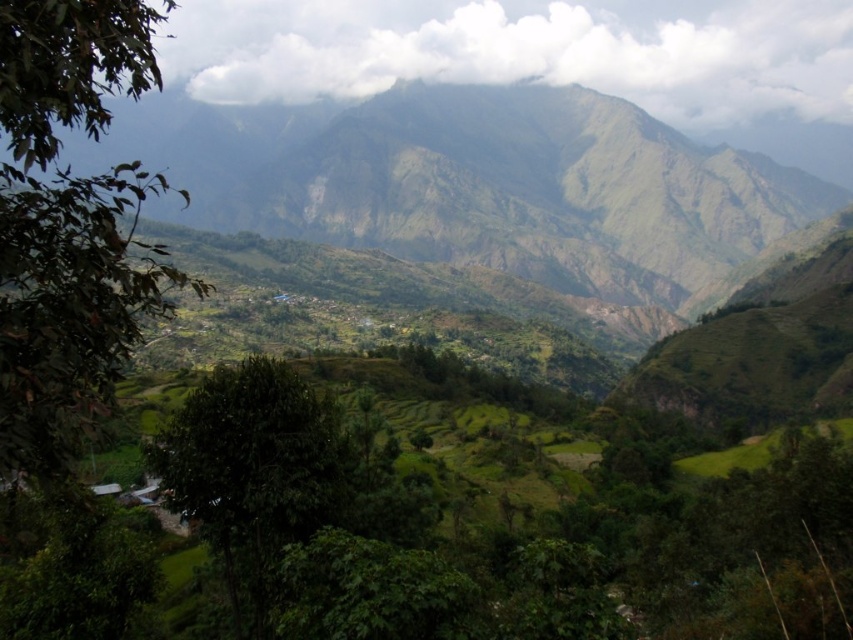
Does green grassy mountain at center have a smaller size compared to green leafy tree at left?

No, green grassy mountain at center is not smaller than green leafy tree at left.

Between point (247, 152) and point (131, 60), which one is positioned behind?

Positioned behind is point (247, 152).

What do you see at coordinates (480, 184) in the screenshot?
I see `green grassy mountain at center` at bounding box center [480, 184].

Find the location of a particular element. green grassy mountain at center is located at coordinates (480, 184).

Does green leafy tree at left have a lesser width compared to green leafy tree at center?

No, green leafy tree at left is not thinner than green leafy tree at center.

Does point (74, 284) lie behind point (219, 538)?

No, it is not.

Measure the distance between point (120, 54) and camera.

A distance of 16.67 meters exists between point (120, 54) and camera.

Locate an element on the screen. The width and height of the screenshot is (853, 640). green leafy tree at left is located at coordinates (68, 225).

Is green grassy mountain at center positioned behind green leafy tree at center?

Yes, it is behind green leafy tree at center.

Does green grassy mountain at center have a greater height compared to green leafy tree at center?

Yes, green grassy mountain at center is taller than green leafy tree at center.

This screenshot has width=853, height=640. I want to click on green grassy mountain at center, so click(480, 184).